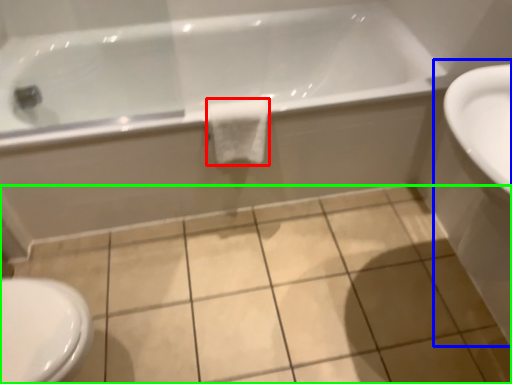
Question: Estimate the real-world distances between objects in this image. Which object is farther from bath towel (highlighted by a red box), sink (highlighted by a blue box) or ceramic tile (highlighted by a green box)?

Choices:
 (A) sink
 (B) ceramic tile

Answer: (A)